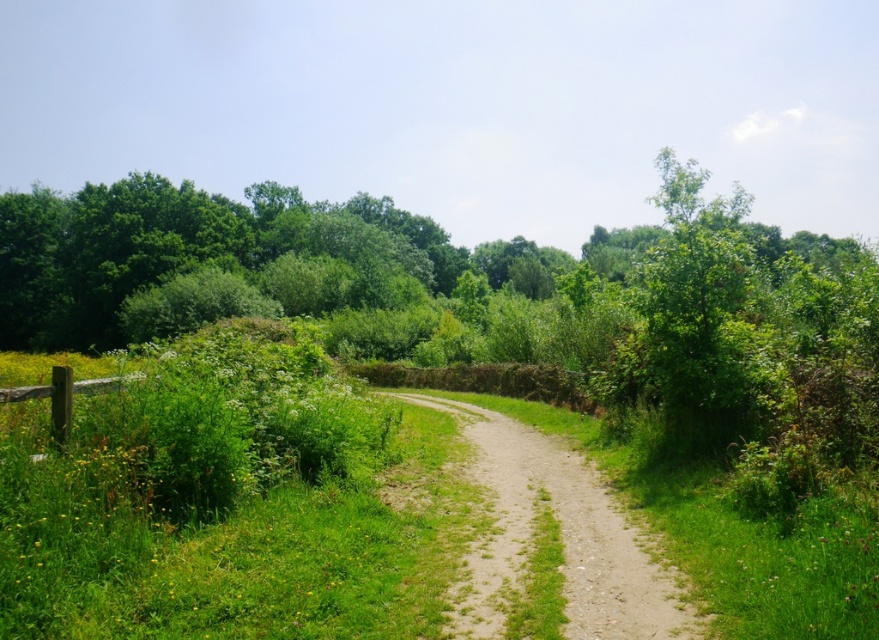
You are planning to take a photo of the green leafy tree at left and the green grass at center. Which object should you focus on first if you want to capture both in the same frame without moving the camera?

The green leafy tree at left is above the green grass at center, so you should focus on the green leafy tree at left first to ensure both are in focus.